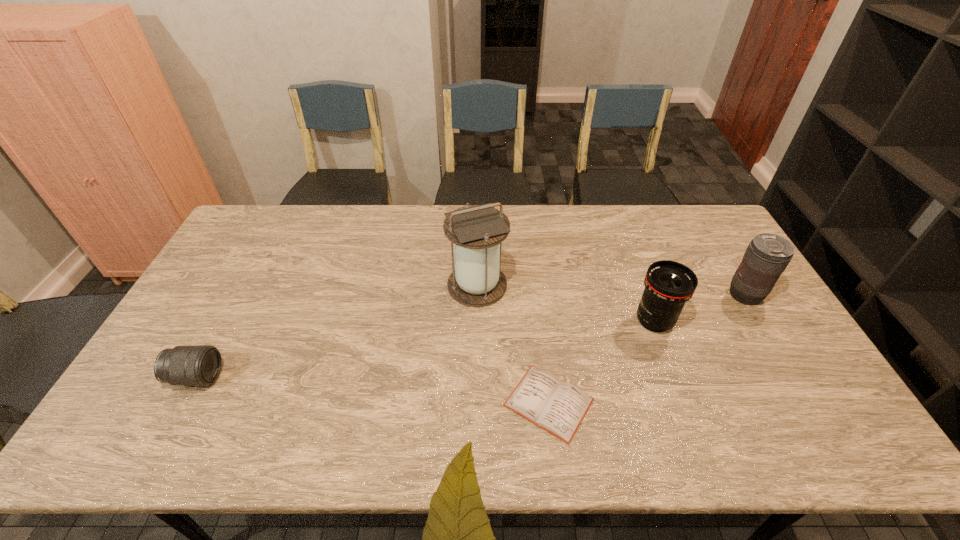
I want to click on vacant space located on the front of the fourth object from left to right, so click(690, 417).

At what (x,y) coordinates should I click in order to perform the action: click on free spot located 0.050m on the surface of the nearest telephoto lens. Please return your answer as a coordinate pair (x, y). Image resolution: width=960 pixels, height=540 pixels. Looking at the image, I should click on (240, 377).

Find the location of `vacant space situated 0.400m on the right of the shortest object`. vacant space situated 0.400m on the right of the shortest object is located at coordinates (756, 402).

Where is `object present at the near edge`? object present at the near edge is located at coordinates (558, 407).

Where is `object located in the left edge section of the desktop`? This screenshot has width=960, height=540. object located in the left edge section of the desktop is located at coordinates (200, 365).

Where is `object located in the right edge section of the desktop`? Image resolution: width=960 pixels, height=540 pixels. object located in the right edge section of the desktop is located at coordinates (767, 256).

The image size is (960, 540). Find the location of `vacant space at the far edge`. vacant space at the far edge is located at coordinates (333, 219).

Where is `vacant space at the near edge of the desktop`? vacant space at the near edge of the desktop is located at coordinates (608, 425).

In the image, there is a desktop. At what (x,y) coordinates should I click in order to perform the action: click on free space at the near left corner. Please return your answer as a coordinate pair (x, y). Image resolution: width=960 pixels, height=540 pixels. Looking at the image, I should click on (126, 429).

Find the location of a particular element. Image resolution: width=960 pixels, height=540 pixels. vacant area at the far right corner is located at coordinates (708, 223).